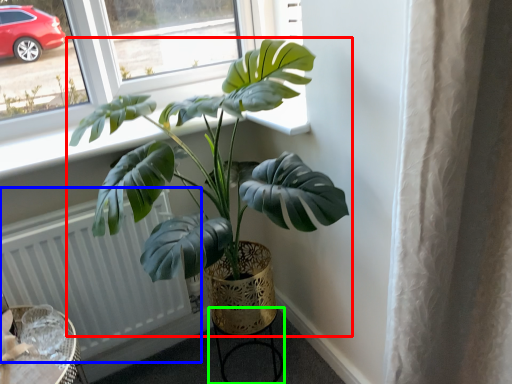
Question: Which object is the closest to the houseplant (highlighted by a red box)? Choose among these: radiator (highlighted by a blue box) or round table (highlighted by a green box).

Choices:
 (A) radiator
 (B) round table

Answer: (A)